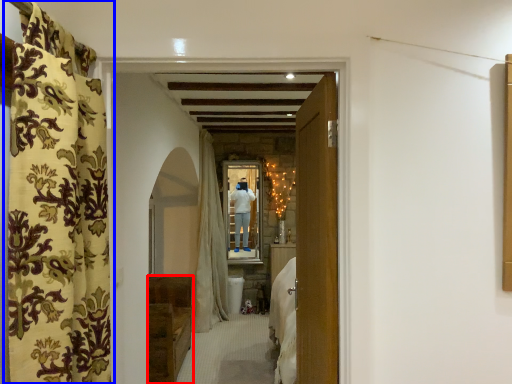
Question: Which object appears farthest to the camera in this image, furniture (highlighted by a red box) or curtain (highlighted by a blue box)?

Choices:
 (A) furniture
 (B) curtain

Answer: (A)